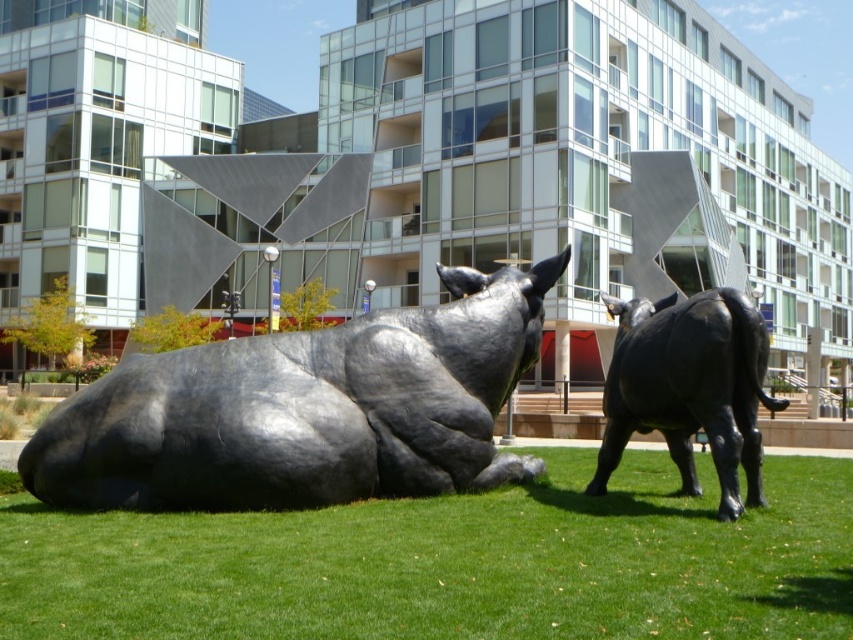
You are an art curator planning to move the polished black bull at center to align it with the building entrance. The entrance is 12 meters away from its current position. Can you position it exactly at 12 meters without exceeding the distance?

The polished black bull at center is currently 11.93 meters away from the entrance. Since 11.93 meters is less than 12 meters, you can move it forward by 0.07 meters to reach the exact 12 meters distance without exceeding the required distance.

In the scene shown: You are an art student analyzing the sculpture arrangement in the image. You notice two bulls, the polished black bull at center and the black polished metal bull at right. Which bull appears to be the larger one in size?

The black polished metal bull at right is larger than the polished black bull at center.

You are an art curator planning to move the polished black bull at center and the black polished metal bull at right to a new exhibition space. The entrance of the exhibition hall has a doorway that is 3 meters wide. Can both bulls fit through the doorway side by side without rotating them?

The polished black bull at center might be wider than black polished metal bull at right, so it is uncertain if both can fit through the 3 meter wide doorway side by side without rotating them. The total width of both bulls combined may exceed the doorway width.